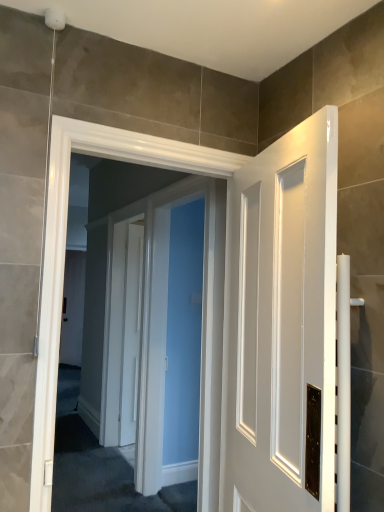
Question: Relative to white glossy door at center, is white glossy door at center in front or behind?

Choices:
 (A) behind
 (B) front

Answer: (A)

Question: From a real-world perspective, is white glossy door at center above or below white glossy door at center?

Choices:
 (A) below
 (B) above

Answer: (A)

Question: Does point (127, 437) appear closer or farther from the camera than point (205, 454)?

Choices:
 (A) closer
 (B) farther

Answer: (B)

Question: Is white glossy door at center in front of or behind white glossy door at center in the image?

Choices:
 (A) front
 (B) behind

Answer: (A)

Question: Is white glossy door at center inside or outside of white glossy door at center?

Choices:
 (A) inside
 (B) outside

Answer: (B)

Question: From their relative heights in the image, would you say white glossy door at center is taller or shorter than white glossy door at center?

Choices:
 (A) tall
 (B) short

Answer: (B)

Question: Is white glossy door at center wider or thinner than white glossy door at center?

Choices:
 (A) thin
 (B) wide

Answer: (B)